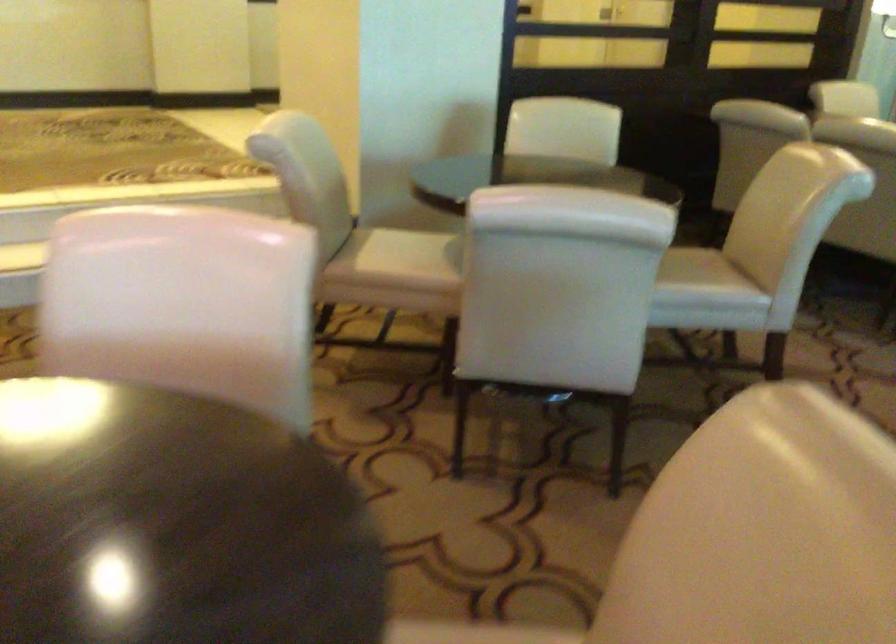
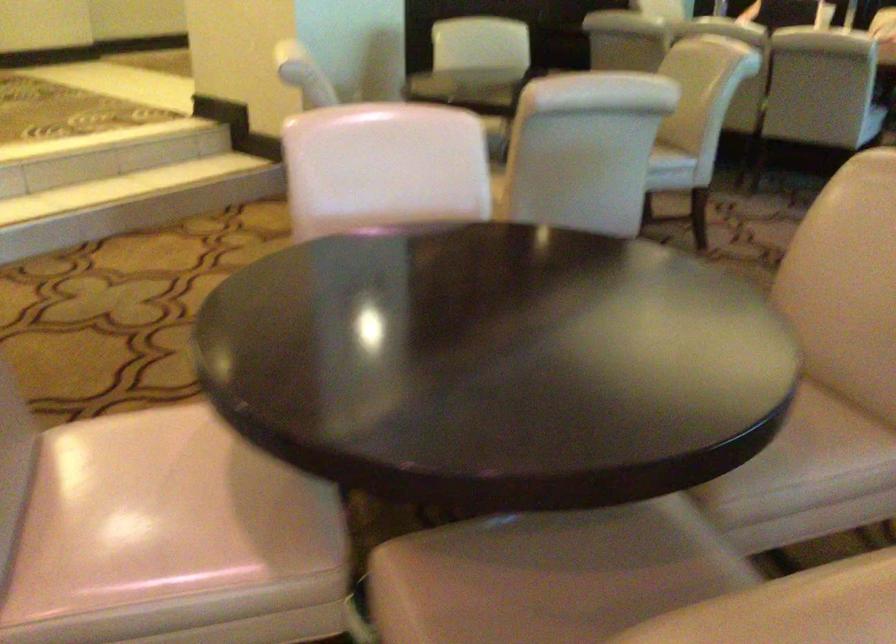
Question: How did the camera likely rotate?

Choices:
 (A) Left
 (B) Right
 (C) Up
 (D) Down

Answer: (B)